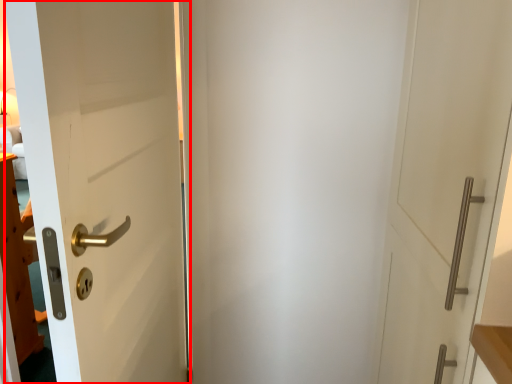
Question: In this image, where is door (annotated by the red box) located relative to door?

Choices:
 (A) right
 (B) left

Answer: (B)